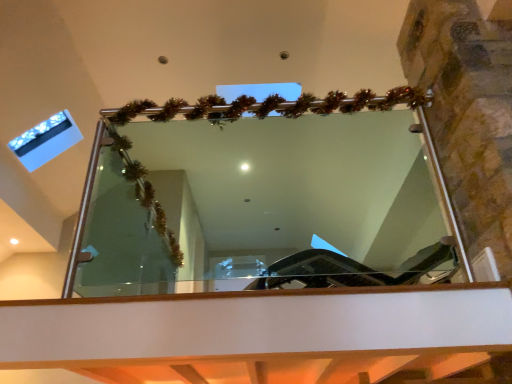
Describe the element at coordinates (46, 140) in the screenshot. I see `transparent glass window at upper left` at that location.

You are a GUI agent. You are given a task and a screenshot of the screen. Output one action in this format:
    pyautogui.click(x=<x>, y=<y>)
    Task: Click on the transparent glass window at upper left
    The height and width of the screenshot is (384, 512).
    Given the screenshot: What is the action you would take?
    pyautogui.click(x=46, y=140)

At what (x,y) coordinates should I click in order to perform the action: click on clear glass mirror at center. Please return your answer as a coordinate pair (x, y). Image resolution: width=512 pixels, height=384 pixels. Looking at the image, I should click on (269, 206).

Measure the distance between clear glass mirror at center and camera.

A distance of 4.04 meters exists between clear glass mirror at center and camera.

Describe the element at coordinates (269, 206) in the screenshot. Image resolution: width=512 pixels, height=384 pixels. I see `clear glass mirror at center` at that location.

Measure the distance between point (389, 136) and camera.

A distance of 16.52 feet exists between point (389, 136) and camera.

This screenshot has height=384, width=512. What are the coordinates of `transparent glass window at upper left` in the screenshot? It's located at (46, 140).

In the image, is clear glass mirror at center on the left side or the right side of transparent glass window at upper left?

clear glass mirror at center is positioned on transparent glass window at upper left's right side.

Does clear glass mirror at center come behind transparent glass window at upper left?

No, it is not.

Which is closer, (98,187) or (58,145)?

Point (98,187) appears to be farther away from the viewer than point (58,145).

From the image's perspective, which is below, clear glass mirror at center or transparent glass window at upper left?

From the image's view, clear glass mirror at center is below.

From a real-world perspective, relative to transparent glass window at upper left, is clear glass mirror at center vertically above or below?

clear glass mirror at center is below transparent glass window at upper left.

Which of these two, clear glass mirror at center or transparent glass window at upper left, is wider?

With larger width is clear glass mirror at center.

Does clear glass mirror at center have a greater height compared to transparent glass window at upper left?

Correct, clear glass mirror at center is much taller as transparent glass window at upper left.

Is clear glass mirror at center smaller than transparent glass window at upper left?

No, clear glass mirror at center is not smaller than transparent glass window at upper left.

Is clear glass mirror at center inside the boundaries of transparent glass window at upper left, or outside?

The correct answer is: outside.

Is clear glass mirror at center not close to transparent glass window at upper left?

clear glass mirror at center is positioned a significant distance from transparent glass window at upper left.

Could you tell me if clear glass mirror at center is turned towards transparent glass window at upper left?

No, clear glass mirror at center is not facing towards transparent glass window at upper left.

What's the angular difference between clear glass mirror at center and transparent glass window at upper left's facing directions?

They differ by 87.7 degrees in their facing directions.

This screenshot has height=384, width=512. Identify the location of mirror located below the transparent glass window at upper left (from the image's perspective). (269, 206).

Considering the positions of objects transparent glass window at upper left and clear glass mirror at center in the image provided, who is more to the left, transparent glass window at upper left or clear glass mirror at center?

transparent glass window at upper left is more to the left.

Which is in front, transparent glass window at upper left or clear glass mirror at center?

clear glass mirror at center is in front.

Is point (62, 132) behind point (178, 275)?

No, (62, 132) is closer to viewer.

From the image's perspective, who appears lower, transparent glass window at upper left or clear glass mirror at center?

clear glass mirror at center.

From a real-world perspective, is transparent glass window at upper left positioned above or below clear glass mirror at center?

Clearly, from a real-world perspective, transparent glass window at upper left is above clear glass mirror at center.

In terms of width, does transparent glass window at upper left look wider or thinner when compared to clear glass mirror at center?

In the image, transparent glass window at upper left appears to be more narrow than clear glass mirror at center.

Is transparent glass window at upper left shorter than clear glass mirror at center?

Yes.

Which of these two, transparent glass window at upper left or clear glass mirror at center, is smaller?

With smaller size is transparent glass window at upper left.

Is transparent glass window at upper left not inside clear glass mirror at center?

Yes, transparent glass window at upper left is located beyond the bounds of clear glass mirror at center.

Can you see transparent glass window at upper left touching clear glass mirror at center?

No, transparent glass window at upper left is not touching clear glass mirror at center.

Could you tell me if transparent glass window at upper left is facing clear glass mirror at center?

No, transparent glass window at upper left is not turned towards clear glass mirror at center.

At what (x,y) coordinates should I click in order to perform the action: click on window above the clear glass mirror at center (from the image's perspective). Please return your answer as a coordinate pair (x, y). This screenshot has height=384, width=512. Looking at the image, I should click on (46, 140).

In order to click on window on the left of the clear glass mirror at center in this screenshot , I will do `click(46, 140)`.

Where is `mirror in front of the transparent glass window at upper left`? The width and height of the screenshot is (512, 384). mirror in front of the transparent glass window at upper left is located at coordinates (269, 206).